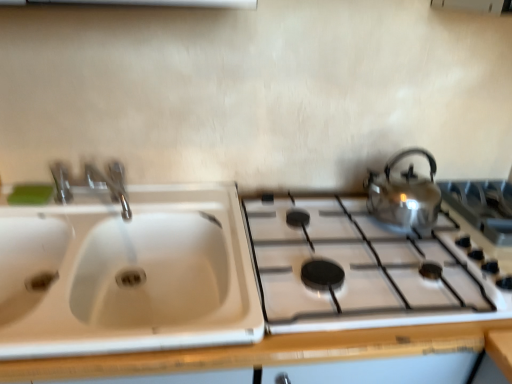
Find the location of a particular element. Image resolution: width=512 pixels, height=384 pixels. vacant area that lies to the right of green matte soap at upper left is located at coordinates (88, 208).